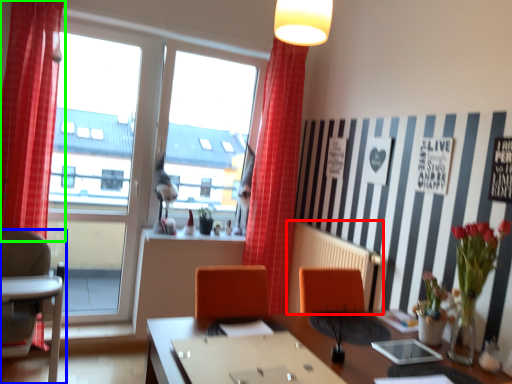
Question: Which is nearer to the radiator (highlighted by a red box)? chair (highlighted by a blue box) or curtain (highlighted by a green box).

Choices:
 (A) chair
 (B) curtain

Answer: (A)